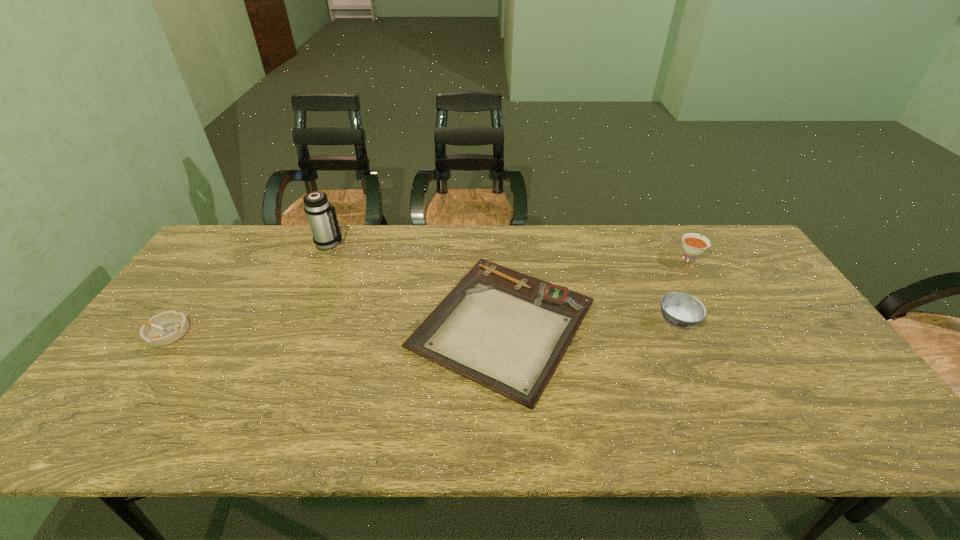
The height and width of the screenshot is (540, 960). I want to click on vacant space at the far edge of the desktop, so click(529, 268).

You are a GUI agent. You are given a task and a screenshot of the screen. Output one action in this format:
    pyautogui.click(x=<x>, y=<y>)
    Task: Click on the free space at the near edge of the desktop
    This screenshot has height=540, width=960.
    Given the screenshot: What is the action you would take?
    pyautogui.click(x=426, y=418)

Find the location of `free region at the left edge of the desktop`. free region at the left edge of the desktop is located at coordinates (109, 396).

Image resolution: width=960 pixels, height=540 pixels. In the image, there is a desktop. In order to click on vacant space at the right edge in this screenshot , I will do `click(776, 352)`.

The width and height of the screenshot is (960, 540). I want to click on blank space at the far left corner of the desktop, so click(259, 236).

The height and width of the screenshot is (540, 960). What are the coordinates of `free space between the tallest object and the second shortest object` in the screenshot? It's located at (248, 288).

Identify the location of vacant area that lies between the second object from right to left and the shortest object. This screenshot has height=540, width=960. (590, 322).

This screenshot has height=540, width=960. Identify the location of empty space between the teacup and the third object from right to left. (596, 291).

Find the location of a particular element. The height and width of the screenshot is (540, 960). vacant area that lies between the shorter ashtray and the fourth shortest object is located at coordinates (428, 295).

The height and width of the screenshot is (540, 960). What are the coordinates of `vacant point located between the leftmost object and the rightmost object` in the screenshot? It's located at (428, 295).